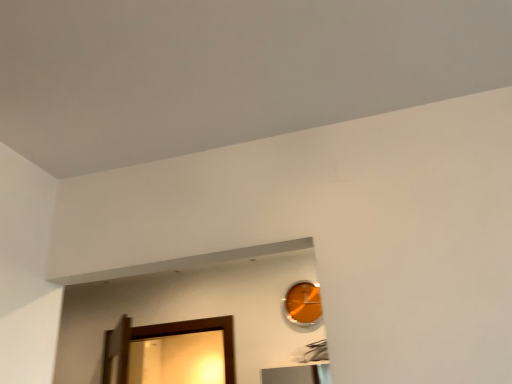
Describe the element at coordinates (303, 303) in the screenshot. The image size is (512, 384). I see `orange glass clock at upper center` at that location.

Identify the location of orange glass clock at upper center. (303, 303).

From the picture: What is the approximate height of orange glass clock at upper center?

The height of orange glass clock at upper center is 10.61 inches.

Find the location of `orange glass clock at upper center`. orange glass clock at upper center is located at coordinates (303, 303).